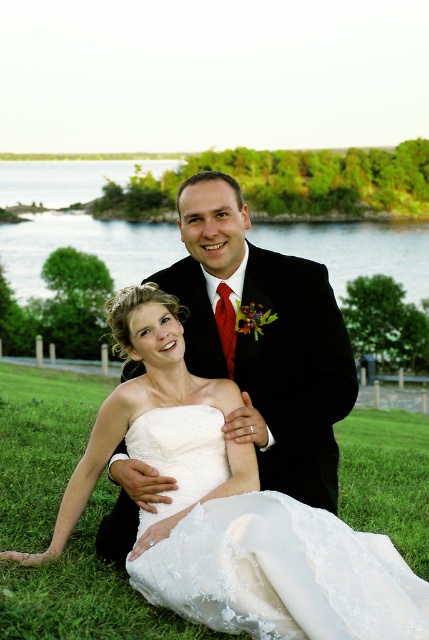
You are a photographer at the wedding and need to position yourself to capture both the white satin dress at center and the white lace dress at lower center in the same frame. Which dress should you focus on first to ensure both are in the frame?

The white satin dress at center is larger in size than the white lace dress at lower center, so you should focus on positioning yourself to include the larger white satin dress at center first, ensuring there is enough space for the smaller white lace dress at lower center in the frame.

You are a photographer standing at the edge of the lake, preparing to take a photo of the wedding scene. The camera you are using has a maximum focus range of 4 meters. Will you be able to clearly capture the black satin suit at center in your photo?

The black satin suit at center is 3.52 meters away from the viewer. Since the camera can focus up to 4 meters, it is within the maximum range, so yes, the photographer can clearly capture the black satin suit at center in the photo.

You are a photographer planning to take a group photo of the couple. The camera frame can only accommodate the width of the black satin suit at center. Will the white satin dress at center fit within the frame?

The white satin dress at center has a larger width than the black satin suit at center, so it will not fit within the frame designed for the suit.